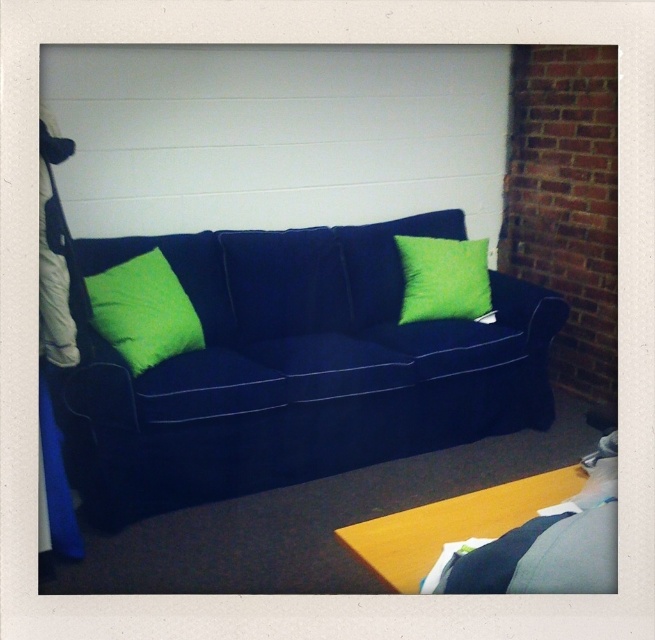
You are arranging a living room and want to place a decorative item between the lime green fabric pillow at left and the lime green fabric pillow at center. Based on their positions, where should you place the item to ensure it sits between them?

The lime green fabric pillow at left is below the lime green fabric pillow at center, so to place an item between them, you should position it in the space between the lower left pillow and the higher center pillow, ensuring it is above the lime green fabric pillow at left and below the lime green fabric pillow at center.